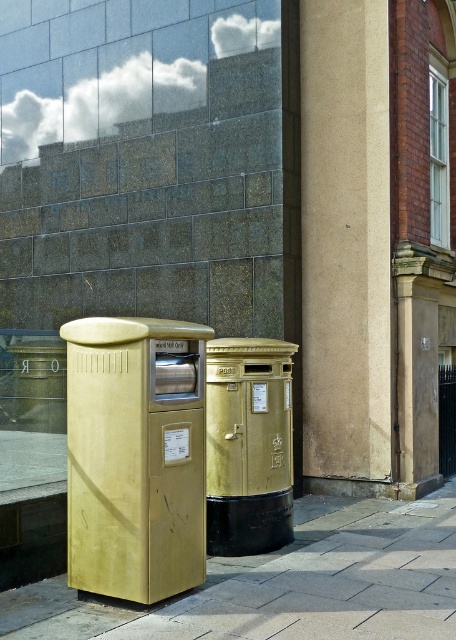
Question: Which object is the closest to the matte gold mailbox at left?

Choices:
 (A) gold matte postbox at center
 (B) smooth concrete pavement at lower center

Answer: (A)

Question: Does smooth concrete pavement at lower center have a larger size compared to gold matte postbox at center?

Choices:
 (A) no
 (B) yes

Answer: (A)

Question: Is smooth beige pillar at center above gold matte postbox at center?

Choices:
 (A) no
 (B) yes

Answer: (B)

Question: Which of the following is the closest to the observer?

Choices:
 (A) (302, 0)
 (B) (76, 620)
 (C) (79, 388)

Answer: (B)

Question: Is matte gold mailbox at left bigger than gold matte postbox at center?

Choices:
 (A) no
 (B) yes

Answer: (B)

Question: Which of the following is the farthest from the observer?

Choices:
 (A) matte gold mailbox at left
 (B) smooth beige pillar at center

Answer: (B)